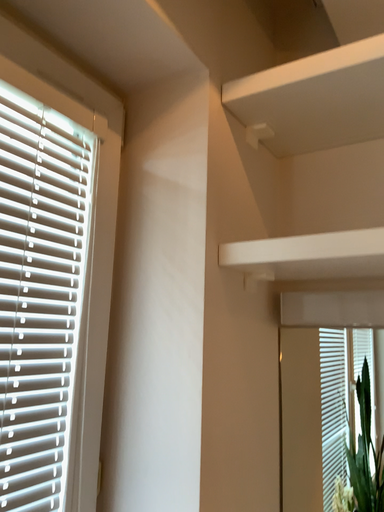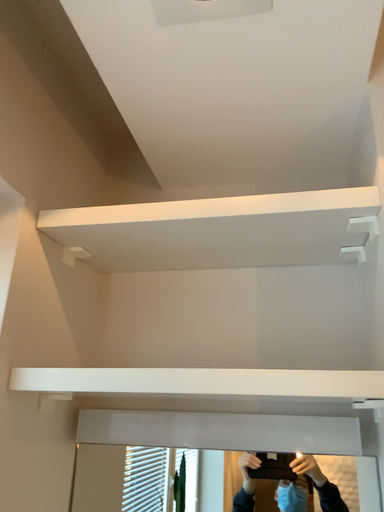
Question: How did the camera likely rotate when shooting the video?

Choices:
 (A) rotated right
 (B) rotated left

Answer: (A)